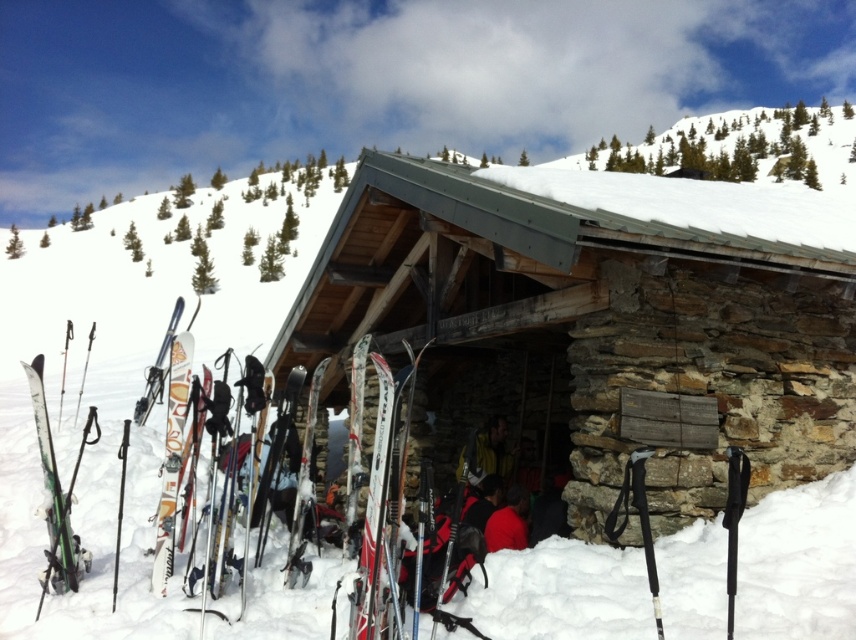
Question: Is matte orange ski at left in front of shiny metallic ski at center?

Choices:
 (A) no
 (B) yes

Answer: (B)

Question: Considering the real-world distances, which object is farthest from the white glossy skis at center?

Choices:
 (A) matte orange ski at left
 (B) white glossy ski at center
 (C) green matte skis at left
 (D) shiny metallic ski at center

Answer: (C)

Question: Which of the following is the farthest from the observer?

Choices:
 (A) white glossy ski at center
 (B) green matte skis at left
 (C) shiny metallic ski at center

Answer: (A)

Question: Which of the following is the farthest from the observer?

Choices:
 (A) (167, 500)
 (B) (520, 486)
 (C) (300, 492)
 (D) (56, 506)

Answer: (B)

Question: Does white glossy skis at center appear under matte orange ski at left?

Choices:
 (A) yes
 (B) no

Answer: (B)

Question: Is green matte skis at left bigger than red fabric jacket at center?

Choices:
 (A) yes
 (B) no

Answer: (A)